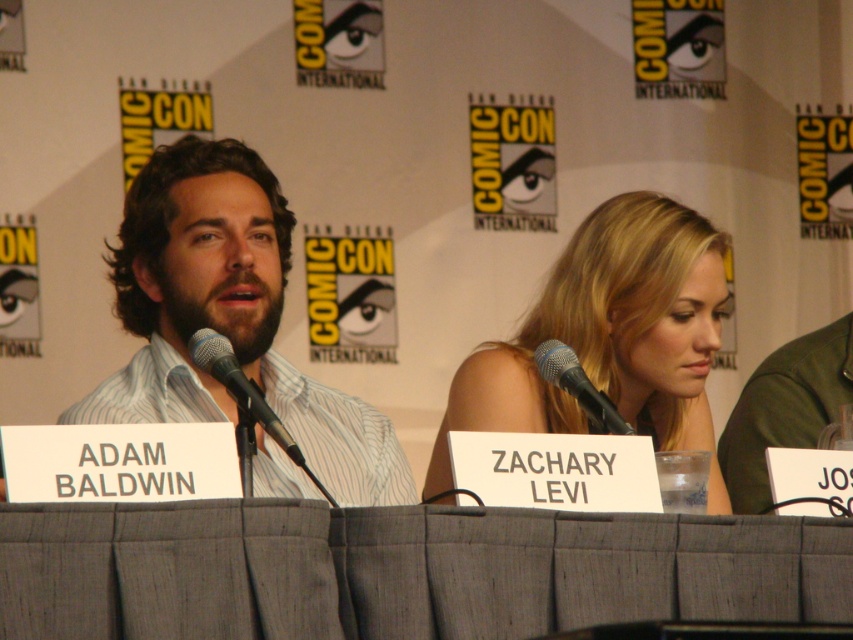
Is blonde hair at center to the right of silver metallic microphone at center from the viewer's perspective?

Correct, you'll find blonde hair at center to the right of silver metallic microphone at center.

Is point (467, 422) positioned before point (561, 376)?

No, it is behind (561, 376).

Where is `blonde hair at center`? The image size is (853, 640). blonde hair at center is located at coordinates (610, 337).

Who is positioned more to the left, black matte microphone at center or silver metallic microphone at center?

Positioned to the left is black matte microphone at center.

Is black matte microphone at center positioned behind silver metallic microphone at center?

That is False.

Who is more distant from viewer, (202, 369) or (582, 381)?

The point (582, 381) is more distant.

What are the coordinates of `black matte microphone at center` in the screenshot? It's located at (239, 387).

Is white striped shirt at center to the right of black matte microphone at center from the viewer's perspective?

Incorrect, white striped shirt at center is not on the right side of black matte microphone at center.

Between white striped shirt at center and black matte microphone at center, which one is positioned higher?

white striped shirt at center

This screenshot has width=853, height=640. What do you see at coordinates (227, 316) in the screenshot?
I see `white striped shirt at center` at bounding box center [227, 316].

The width and height of the screenshot is (853, 640). Identify the location of white striped shirt at center. (227, 316).